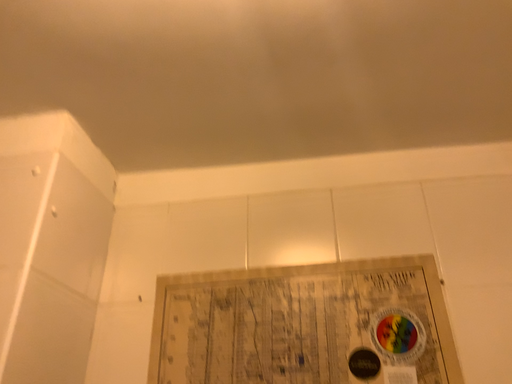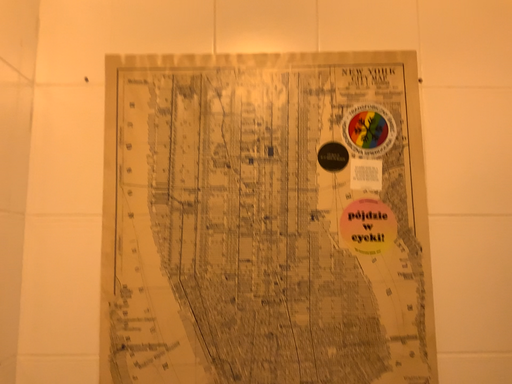
Question: How did the camera likely rotate when shooting the video?

Choices:
 (A) rotated downward
 (B) rotated upward

Answer: (A)